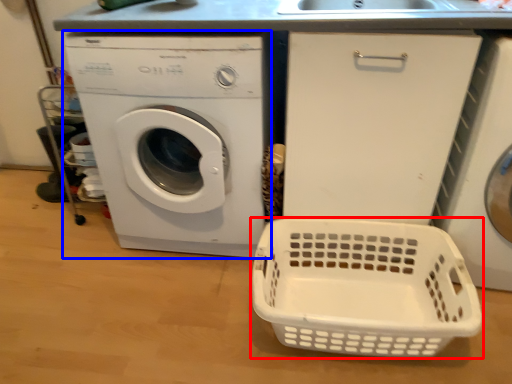
Question: Which of the following is the farthest to the observer, basket (highlighted by a red box) or washing machine (highlighted by a blue box)?

Choices:
 (A) basket
 (B) washing machine

Answer: (B)